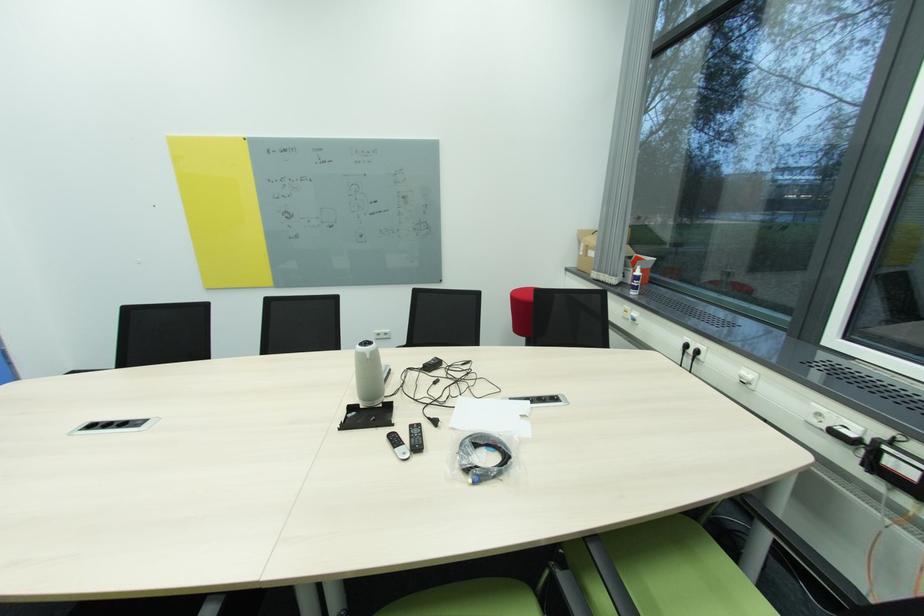
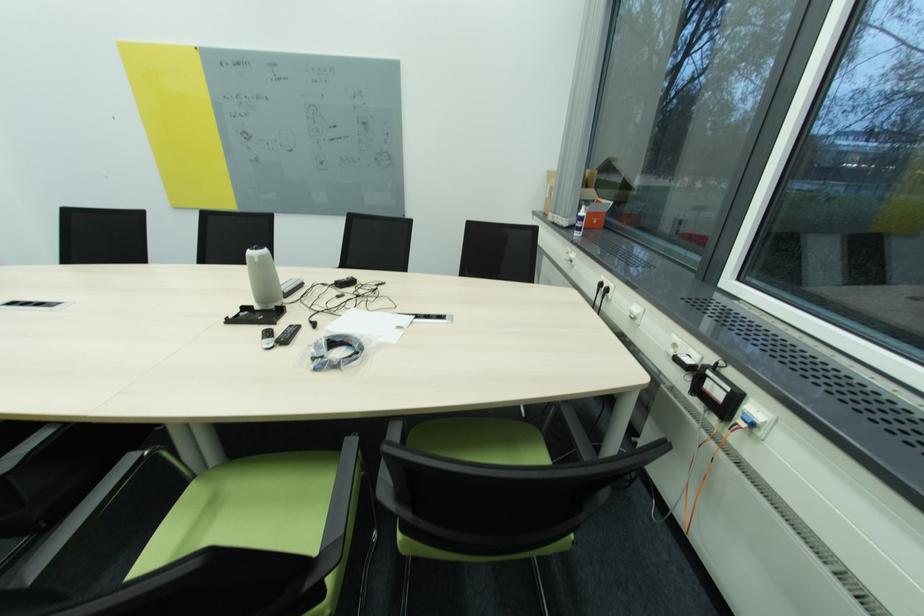
In the second image, find the point that corresponds to the point at 746,379 in the first image.

(636, 314)